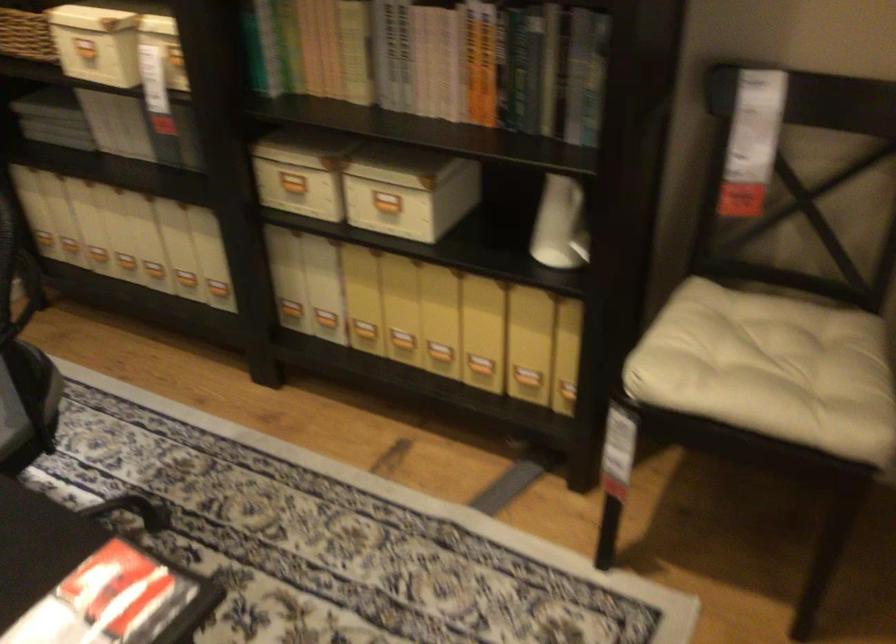
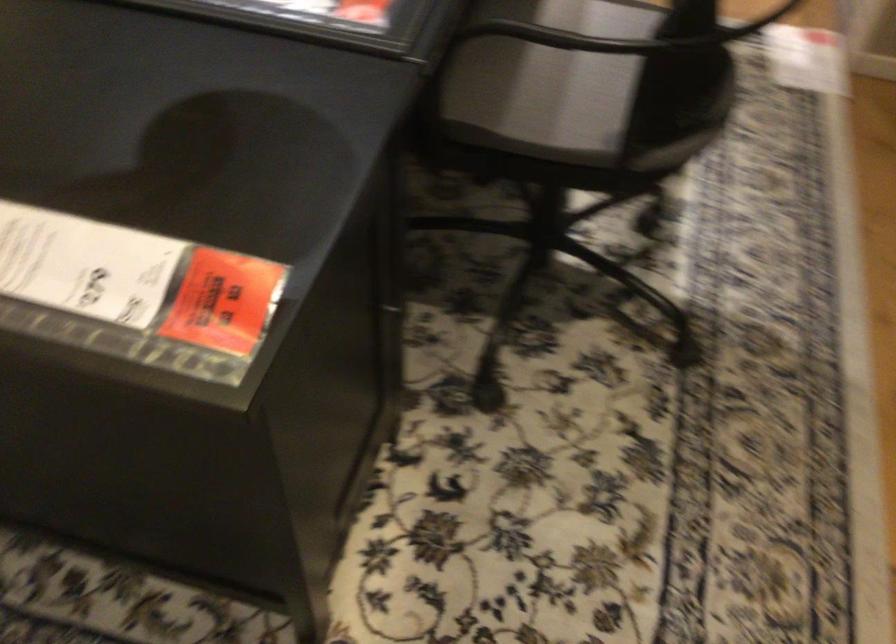
First-person continuous shooting, in which direction is the camera rotating?

The camera's rotation is toward left-down.